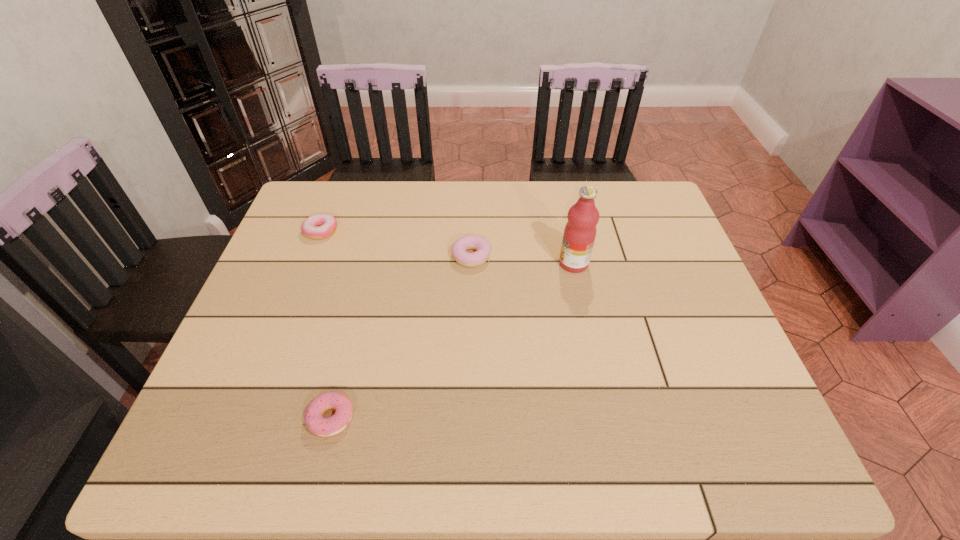
Find the location of a particular element. The width and height of the screenshot is (960, 540). vacant space at the left edge of the desktop is located at coordinates (267, 347).

This screenshot has height=540, width=960. Identify the location of vacant space at the right edge of the desktop. (648, 272).

Image resolution: width=960 pixels, height=540 pixels. I want to click on free space at the far left corner, so click(x=306, y=206).

The height and width of the screenshot is (540, 960). In the image, there is a desktop. What are the coordinates of `vacant space at the near left corner` in the screenshot? It's located at (212, 446).

Locate an element on the screen. free location at the far right corner of the desktop is located at coordinates (615, 188).

At what (x,y) coordinates should I click in order to perform the action: click on empty location between the farthest object and the rightmost doughnut. Please return your answer as a coordinate pair (x, y). Image resolution: width=960 pixels, height=540 pixels. Looking at the image, I should click on (396, 244).

Identify the location of free spot between the second object from left to right and the leftmost object. (326, 325).

Where is `free space between the farthest object and the tallest object`? Image resolution: width=960 pixels, height=540 pixels. free space between the farthest object and the tallest object is located at coordinates (447, 247).

The width and height of the screenshot is (960, 540). In order to click on vacant space that is in between the second nearest doughnut and the tallest object in this screenshot , I will do `click(522, 260)`.

What are the coordinates of `blank region between the rightmost object and the rightmost doughnut` in the screenshot? It's located at (522, 260).